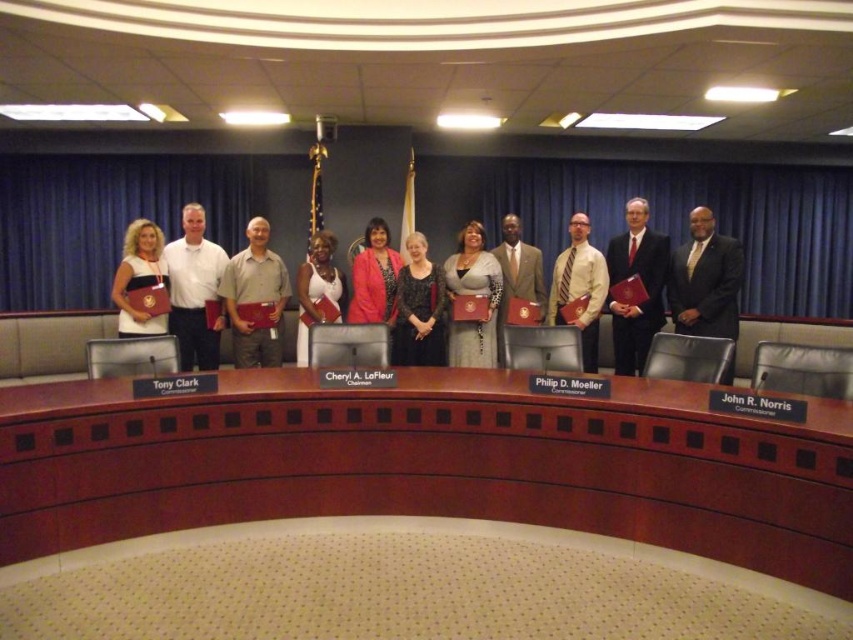
Question: Which object is the closest to the matte silver dress at center?

Choices:
 (A) brown wood table at center
 (B) matte brown suit at center

Answer: (B)

Question: Which object is positioned closest to the matte silver dress at center?

Choices:
 (A) white satin dress at center
 (B) white striped tie at center

Answer: (B)

Question: Does matte gray shirt at center appear on the left side of black textured dress at center?

Choices:
 (A) yes
 (B) no

Answer: (A)

Question: Estimate the real-world distances between objects in this image. Which object is closer to the matte brown suit at center?

Choices:
 (A) matte black suit at center
 (B) black textured dress at center
 (C) brown wood table at center

Answer: (B)

Question: Can you confirm if black suit at center is positioned below matte black dress at left?

Choices:
 (A) yes
 (B) no

Answer: (B)

Question: Is brown wood table at center smaller than matte silver dress at center?

Choices:
 (A) yes
 (B) no

Answer: (B)